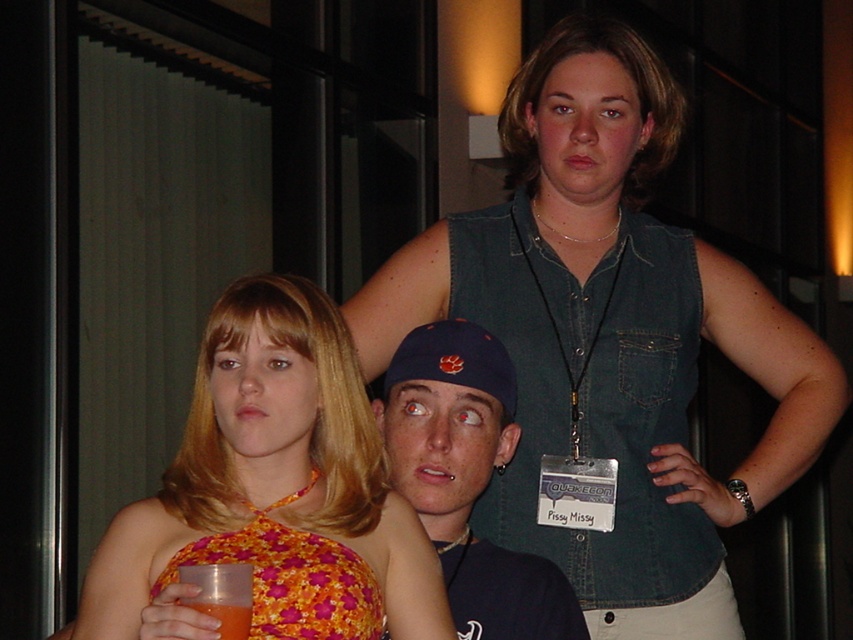
Question: Based on their relative distances, which object is farther from the denim vest at upper center?

Choices:
 (A) matte blue cap at center
 (B) floral halter top at center
 (C) floral print fabric dress at center

Answer: (C)

Question: Which point is farther to the camera?

Choices:
 (A) (223, 605)
 (B) (497, 456)
 (C) (331, 442)
 (D) (482, 214)

Answer: (D)

Question: Does floral print fabric dress at center appear over translucent plastic cup at lower left?

Choices:
 (A) no
 (B) yes

Answer: (B)

Question: Can you confirm if denim vest at upper center is thinner than matte blue cap at center?

Choices:
 (A) no
 (B) yes

Answer: (A)

Question: Among these objects, which one is nearest to the camera?

Choices:
 (A) denim vest at upper center
 (B) floral halter top at center

Answer: (B)

Question: Is floral print fabric dress at center smaller than translucent plastic cup at lower left?

Choices:
 (A) no
 (B) yes

Answer: (A)